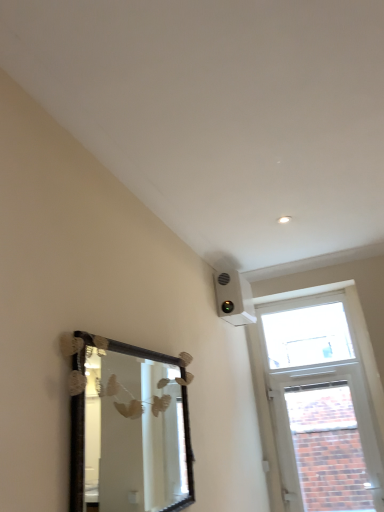
Question: Considering the positions of brick textured window at upper right, which is the 1th window in bottom-to-top order, and transparent glass window at upper right, which is the second window in bottom-to-top order, in the image, is brick textured window at upper right, which is the 1th window in bottom-to-top order, bigger or smaller than transparent glass window at upper right, which is the second window in bottom-to-top order,?

Choices:
 (A) big
 (B) small

Answer: (A)

Question: Is brick textured window at upper right, which is the 1th window in bottom-to-top order, to the left or to the right of transparent glass window at upper right, the 1th window when ordered from top to bottom, in the image?

Choices:
 (A) right
 (B) left

Answer: (A)

Question: Estimate the real-world distances between objects in this image. Which object is farther from the wooden-framed mirror at lower left?

Choices:
 (A) brick textured window at upper right, which ranks as the 2th window in top-to-bottom order
 (B) transparent glass window at upper right, which is the second window in bottom-to-top order

Answer: (B)

Question: Considering the real-world distances, which object is farthest from the transparent glass window at upper right, which is the second window in bottom-to-top order?

Choices:
 (A) wooden-framed mirror at lower left
 (B) brick textured window at upper right, which ranks as the 2th window in top-to-bottom order

Answer: (A)